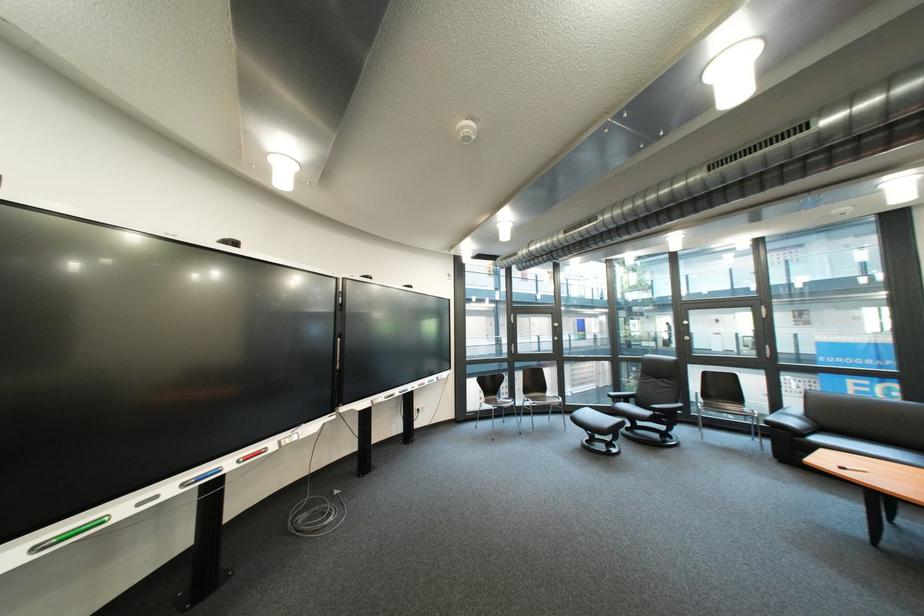
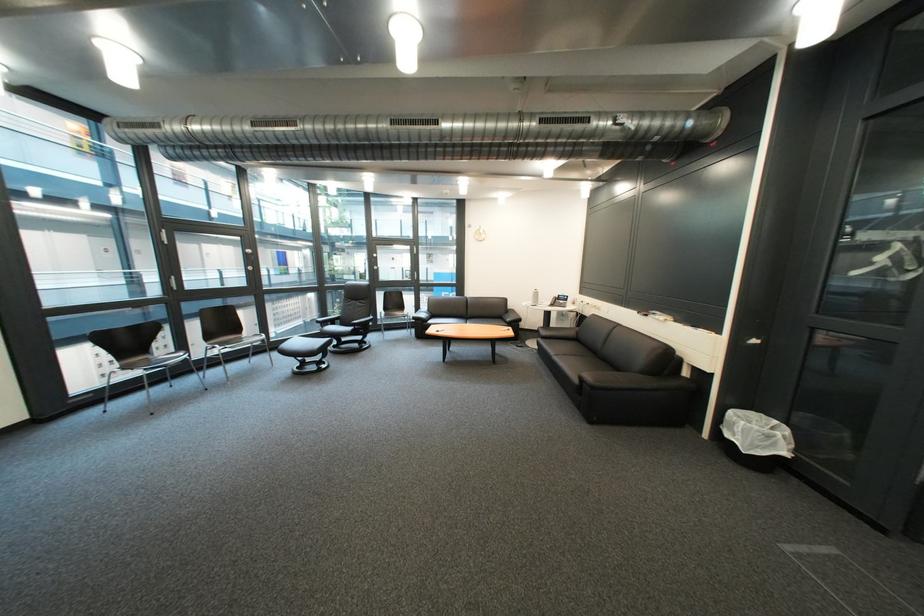
Question: The camera is either moving clockwise (left) or counter-clockwise (right) around the object. The first image is from the beginning of the video and the second image is from the end. Is the camera moving left or right when shooting the video?

Choices:
 (A) Left
 (B) Right

Answer: (A)